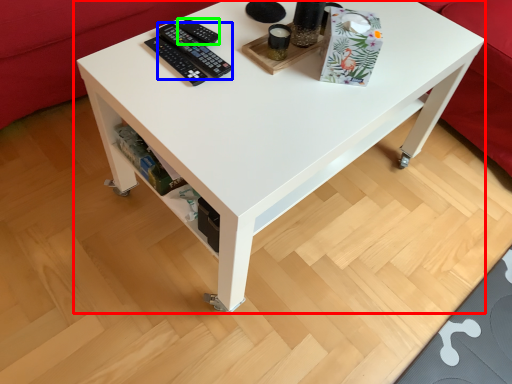
Question: Which object is positioned farthest from table (highlighted by a red box)? Select from control (highlighted by a blue box) and control (highlighted by a green box).

Choices:
 (A) control
 (B) control

Answer: (B)